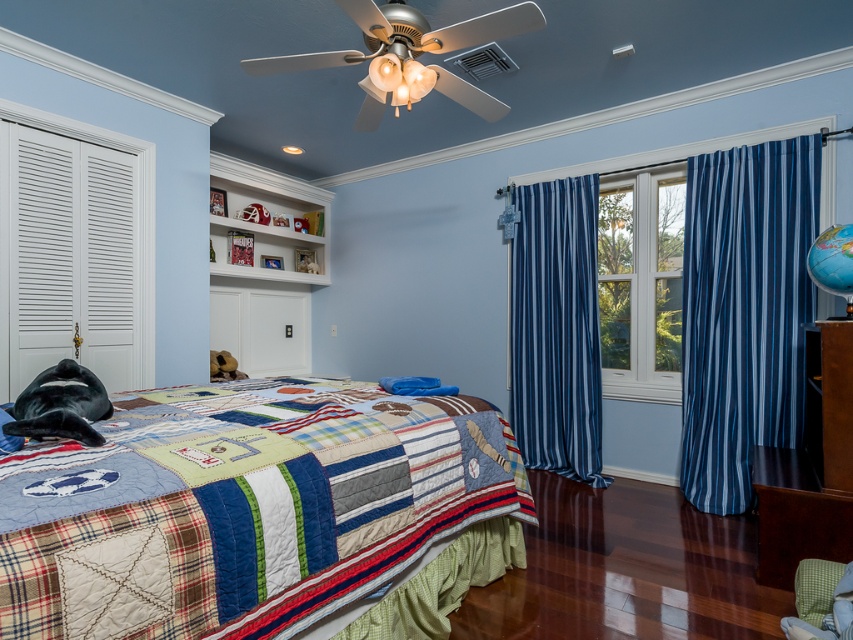
You are a parent trying to hang a new poster that requires 2 meters of space. You see the blue striped curtain at center and the dark brown wood dresser at lower right. Which object has enough space to accommodate the poster?

The blue striped curtain at center is bigger than the dark brown wood dresser at lower right, so the blue striped curtain at center has enough space to accommodate the poster.

You are organizing a sleepover in the bedroom and want to ensure there is enough space for everyone. The patchwork quilt at center and the blue striped curtain at center are both in the way. Which object should you move first to free up more space?

The patchwork quilt at center has a larger width than the blue striped curtain at center, so moving the patchwork quilt at center first would free up more space.